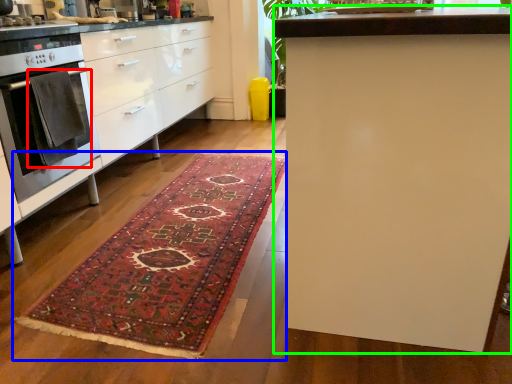
Question: Which object is the closest to the blanket (highlighted by a red box)? Choose among these: mat (highlighted by a blue box) or table (highlighted by a green box).

Choices:
 (A) mat
 (B) table

Answer: (A)